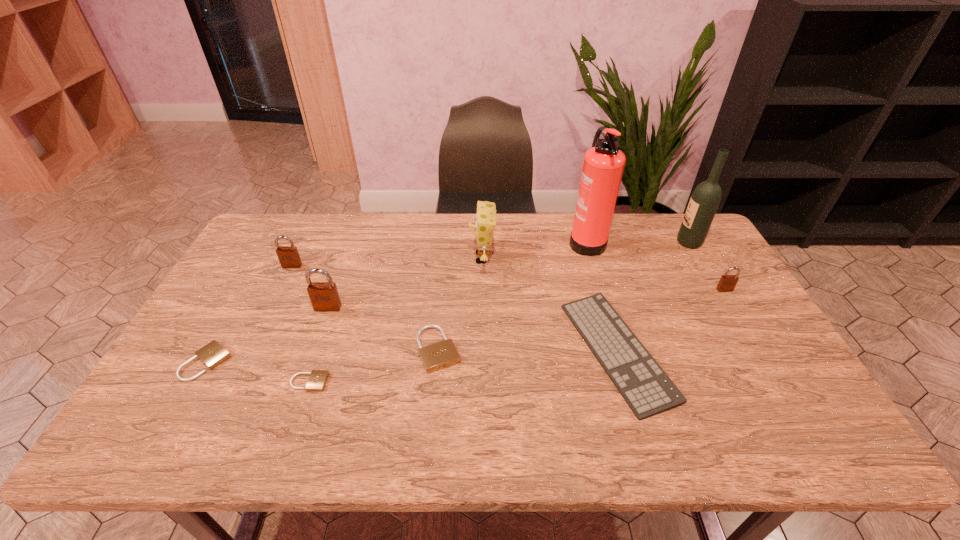
You are a GUI agent. You are given a task and a screenshot of the screen. Output one action in this format:
    pyautogui.click(x=<x>, y=<y>)
    Task: Click on the vacant space located 0.130m at the nozzle of the tallest object
    This screenshot has width=960, height=540.
    Given the screenshot: What is the action you would take?
    pyautogui.click(x=531, y=240)

Identify the location of vacant area situated 0.330m at the nozzle of the tallest object. (473, 240).

Identify the location of vacant space located on the labeled side of the ninth shortest object. (589, 242).

This screenshot has height=540, width=960. I want to click on free space located on the labeled side of the ninth shortest object, so click(x=630, y=242).

I want to click on vacant area situated on the labeled side of the ninth shortest object, so click(x=662, y=242).

This screenshot has width=960, height=540. What are the coordinates of `vacant space positioned 0.270m on the face of the sponge` in the screenshot? It's located at (387, 258).

Find the location of `free space located 0.130m on the face of the sponge`. free space located 0.130m on the face of the sponge is located at coordinates (429, 258).

You are a GUI agent. You are given a task and a screenshot of the screen. Output one action in this format:
    pyautogui.click(x=<x>, y=<y>)
    Task: Click on the vacant region located on the face of the sponge
    The height and width of the screenshot is (540, 960).
    Given the screenshot: What is the action you would take?
    pyautogui.click(x=378, y=258)

At what (x,y) coordinates should I click in order to perform the action: click on free space located on the front-facing side of the tallest padlock. Please return your answer as a coordinate pair (x, y). This screenshot has height=540, width=960. Looking at the image, I should click on 286,426.

At what (x,y) coordinates should I click in order to perform the action: click on free space located on the front-facing side of the farthest brown padlock. Please return your answer as a coordinate pair (x, y). This screenshot has width=960, height=540. Looking at the image, I should click on (284, 283).